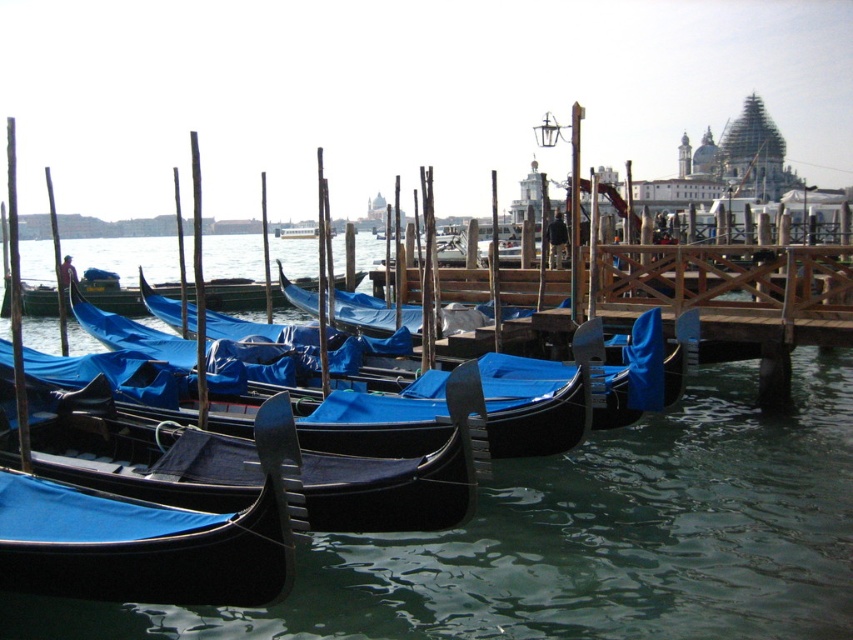
Does shiny black gondola at center appear on the left side of blue glossy gondola at center?

In fact, shiny black gondola at center is to the right of blue glossy gondola at center.

Is shiny black gondola at center taller than blue glossy gondola at center?

Incorrect, shiny black gondola at center's height is not larger of blue glossy gondola at center's.

Between point (442, 529) and point (335, 278), which one is positioned in front?

Point (442, 529)

Find the location of a particular element. The height and width of the screenshot is (640, 853). shiny black gondola at center is located at coordinates (137, 451).

Between greenish water at center and blue glossy gondola at center, which one has more height?

With more height is greenish water at center.

Does greenish water at center have a larger size compared to blue glossy gondola at center?

Yes, greenish water at center is bigger than blue glossy gondola at center.

Measure the distance between point (598, 564) and camera.

23.68 meters

The image size is (853, 640). In order to click on greenish water at center in this screenshot , I will do `click(587, 540)`.

Can you confirm if greenish water at center is positioned to the right of shiny black gondola at center?

In fact, greenish water at center is to the left of shiny black gondola at center.

Looking at this image, can you confirm if greenish water at center is wider than shiny black gondola at center?

Indeed, greenish water at center has a greater width compared to shiny black gondola at center.

Find the location of `greenish water at center`. greenish water at center is located at coordinates (587, 540).